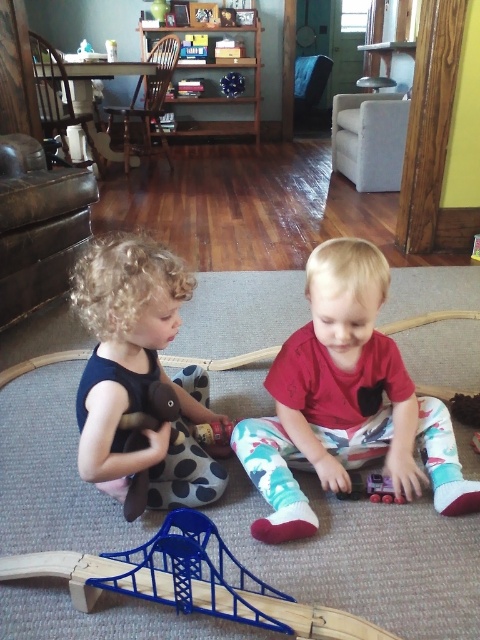
Question: Which point is farther to the camera?

Choices:
 (A) (302, 332)
 (B) (149, 280)
 (C) (344, 493)

Answer: (A)

Question: Does red matte toy car at center have a greater width compared to soft black dress at left?

Choices:
 (A) yes
 (B) no

Answer: (A)

Question: Can you confirm if red matte toy car at center is thinner than soft black dress at left?

Choices:
 (A) no
 (B) yes

Answer: (A)

Question: Where is red matte toy car at center located in relation to rubberized plastic train at center in the image?

Choices:
 (A) right
 (B) left

Answer: (B)

Question: Among these objects, which one is nearest to the camera?

Choices:
 (A) soft black dress at left
 (B) red matte toy car at center

Answer: (A)

Question: Which of the following is the closest to the observer?

Choices:
 (A) soft black dress at left
 (B) red matte toy car at center
 (C) rubberized plastic train at center

Answer: (A)